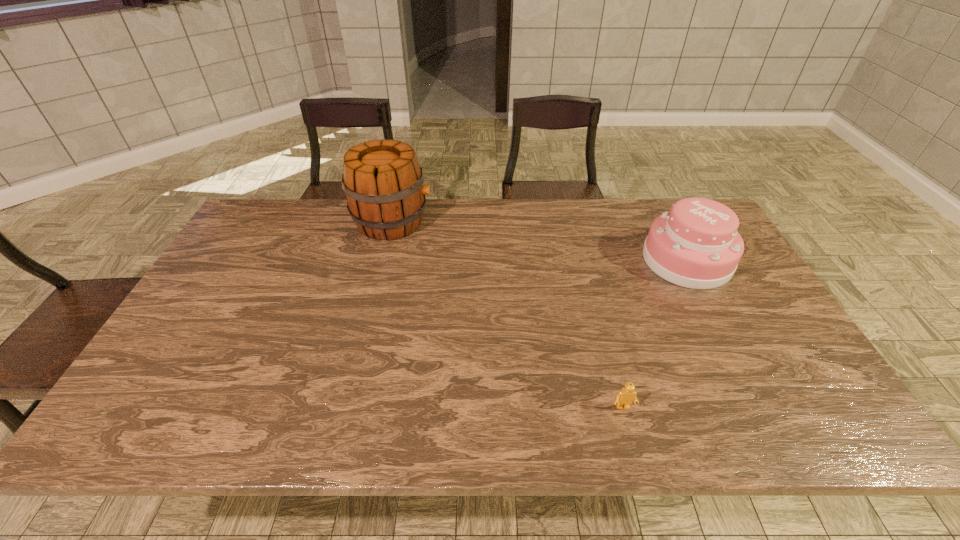
Locate an element on the screen. The width and height of the screenshot is (960, 540). the leftmost object is located at coordinates (382, 179).

Image resolution: width=960 pixels, height=540 pixels. Find the location of `the tallest object`. the tallest object is located at coordinates (382, 179).

Image resolution: width=960 pixels, height=540 pixels. Identify the location of birthday cake. click(696, 245).

The height and width of the screenshot is (540, 960). I want to click on the rightmost object, so tap(696, 245).

Find the location of `the shortest object`. the shortest object is located at coordinates (625, 397).

Where is `Lego`? Lego is located at coordinates (625, 397).

The width and height of the screenshot is (960, 540). In order to click on vacant area situated 0.130m on the side of the tallest object where the spigot is located in this screenshot , I will do [470, 221].

I want to click on vacant space located on the back of the second shortest object, so click(x=661, y=211).

The image size is (960, 540). I want to click on cider present at the far edge, so click(382, 179).

Where is `birthday cake present at the far edge`? birthday cake present at the far edge is located at coordinates (696, 245).